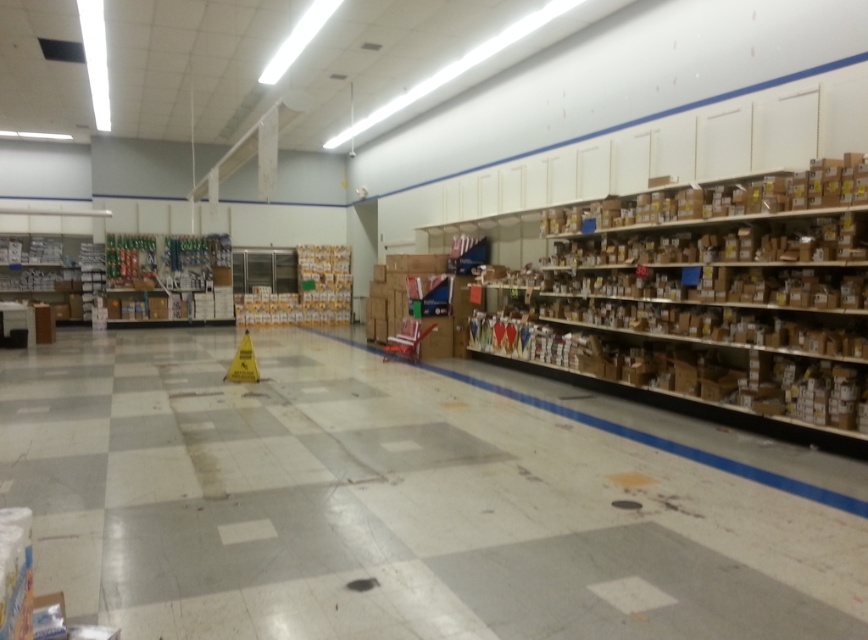
Does point (217, 500) come farther from viewer compared to point (791, 358)?

No, it is in front of (791, 358).

Measure the distance from white glossy floor at center to brown cardboard shelves at right.

white glossy floor at center is 7.26 feet from brown cardboard shelves at right.

Does point (465, 413) come farther from viewer compared to point (528, 301)?

That is False.

Locate an element on the screen. Image resolution: width=868 pixels, height=640 pixels. white glossy floor at center is located at coordinates (406, 500).